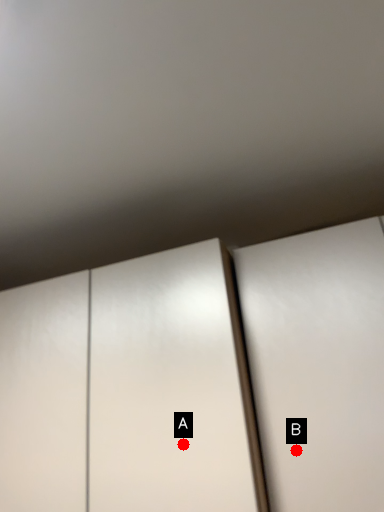
Question: Two points are circled on the image, labeled by A and B beside each circle. Which point is further to the camera?

Choices:
 (A) A is further
 (B) B is further

Answer: (B)